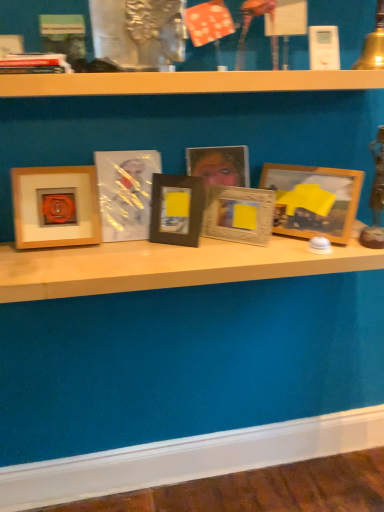
At what (x,y) coordinates should I click in order to perform the action: click on free spot in front of wooden photo frame at center, the 3th picture frame in the right-to-left sequence. Please return your answer as a coordinate pair (x, y). This screenshot has height=512, width=384. Looking at the image, I should click on click(x=225, y=255).